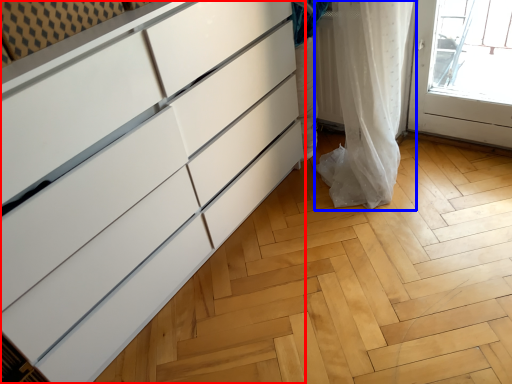
Question: Which object appears farthest to the camera in this image, chest of drawers (highlighted by a red box) or curtain (highlighted by a blue box)?

Choices:
 (A) chest of drawers
 (B) curtain

Answer: (B)